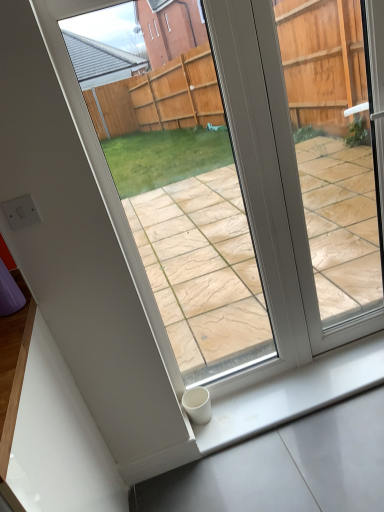
This screenshot has width=384, height=512. In order to click on transparent glass door at center in this screenshot , I will do (299, 193).

The width and height of the screenshot is (384, 512). Describe the element at coordinates (299, 193) in the screenshot. I see `transparent glass door at center` at that location.

What do you see at coordinates (292, 394) in the screenshot? This screenshot has width=384, height=512. I see `white glossy window sill at lower right` at bounding box center [292, 394].

What is the approximate width of white glossy window sill at lower right?

9.73 inches.

Locate an element on the screen. white glossy window sill at lower right is located at coordinates (292, 394).

Measure the distance between white glossy window sill at lower right and camera.

They are 5.53 feet apart.

Locate an element on the screen. The height and width of the screenshot is (512, 384). transparent glass door at center is located at coordinates (299, 193).

Between white glossy window sill at lower right and transparent glass door at center, which one appears on the right side from the viewer's perspective?

From the viewer's perspective, transparent glass door at center appears more on the right side.

Which object is closer to the camera taking this photo, white glossy window sill at lower right or transparent glass door at center?

transparent glass door at center.

Is point (228, 443) less distant than point (263, 36)?

No, (228, 443) is further to viewer.

From the image's perspective, is white glossy window sill at lower right located beneath transparent glass door at center?

Yes.

From a real-world perspective, between white glossy window sill at lower right and transparent glass door at center, who is vertically lower?

In real-world perspective, white glossy window sill at lower right is lower.

Is white glossy window sill at lower right wider than transparent glass door at center?

Yes, white glossy window sill at lower right is wider than transparent glass door at center.

Between white glossy window sill at lower right and transparent glass door at center, which one has less height?

With less height is white glossy window sill at lower right.

In terms of size, does white glossy window sill at lower right appear bigger or smaller than transparent glass door at center?

In the image, white glossy window sill at lower right appears to be smaller than transparent glass door at center.

Is white glossy window sill at lower right surrounding transparent glass door at center?

Actually, transparent glass door at center is outside white glossy window sill at lower right.

Would you say white glossy window sill at lower right is a long distance from transparent glass door at center?

That's not correct — white glossy window sill at lower right is a little close to transparent glass door at center.

Is white glossy window sill at lower right facing towards transparent glass door at center?

No, white glossy window sill at lower right is not aimed at transparent glass door at center.

How many degrees apart are the facing directions of white glossy window sill at lower right and transparent glass door at center?

0.251 degrees separate the facing orientations of white glossy window sill at lower right and transparent glass door at center.

From the picture: How far apart are white glossy window sill at lower right and transparent glass door at center?

They are 13.92 inches apart.

Find the location of `window above the white glossy window sill at lower right (from a real-world perspective)`. window above the white glossy window sill at lower right (from a real-world perspective) is located at coordinates (299, 193).

Can you confirm if transparent glass door at center is positioned to the right of white glossy window sill at lower right?

Correct, you'll find transparent glass door at center to the right of white glossy window sill at lower right.

Is transparent glass door at center further to camera compared to white glossy window sill at lower right?

No, transparent glass door at center is closer to the viewer.

Between point (277, 45) and point (297, 369), which one is positioned behind?

The point (297, 369) is behind.

From the image's perspective, which one is positioned lower, transparent glass door at center or white glossy window sill at lower right?

From the image's view, white glossy window sill at lower right is below.

From a real-world perspective, is transparent glass door at center physically located above or below white glossy window sill at lower right?

From a real-world perspective, transparent glass door at center is physically above white glossy window sill at lower right.

Considering the sizes of objects transparent glass door at center and white glossy window sill at lower right in the image provided, who is thinner, transparent glass door at center or white glossy window sill at lower right?

Thinner between the two is transparent glass door at center.

Considering the sizes of objects transparent glass door at center and white glossy window sill at lower right in the image provided, who is taller, transparent glass door at center or white glossy window sill at lower right?

transparent glass door at center.

Is transparent glass door at center smaller than white glossy window sill at lower right?

Actually, transparent glass door at center might be larger than white glossy window sill at lower right.

Do you think transparent glass door at center is within white glossy window sill at lower right, or outside of it?

transparent glass door at center is outside white glossy window sill at lower right.

Is transparent glass door at center directly adjacent to white glossy window sill at lower right?

transparent glass door at center is not next to white glossy window sill at lower right, and they're not touching.

Based on the photo, does transparent glass door at center turn towards white glossy window sill at lower right?

No, transparent glass door at center is not oriented towards white glossy window sill at lower right.

How different are the orientations of transparent glass door at center and white glossy window sill at lower right in degrees?

The facing directions of transparent glass door at center and white glossy window sill at lower right are 0.251 degrees apart.

Where is `window lying on the right of white glossy window sill at lower right`? The height and width of the screenshot is (512, 384). window lying on the right of white glossy window sill at lower right is located at coordinates (299, 193).

In order to click on window above the white glossy window sill at lower right (from the image's perspective) in this screenshot , I will do `click(299, 193)`.

At what (x,y) coordinates should I click in order to perform the action: click on window sill below the transparent glass door at center (from the image's perspective). Please return your answer as a coordinate pair (x, y). Looking at the image, I should click on (292, 394).